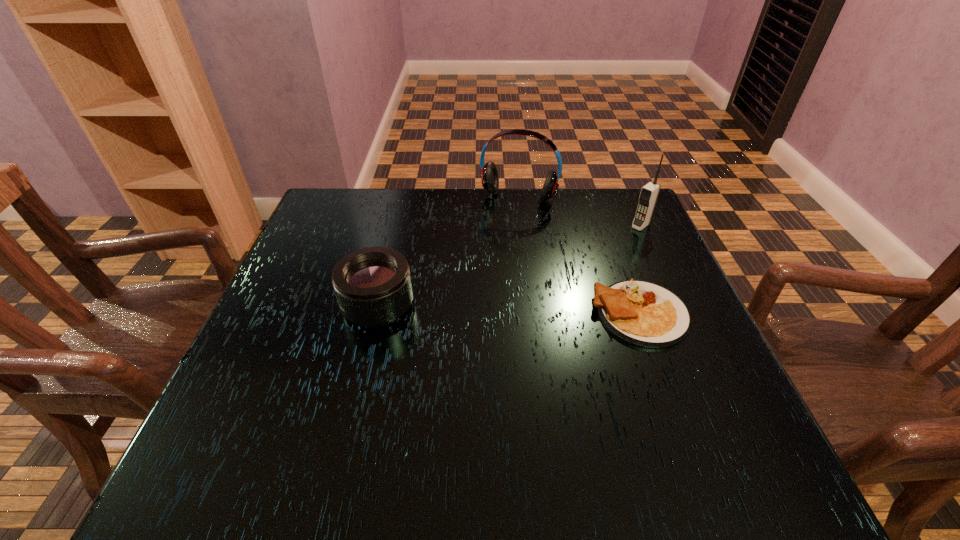
Where is `the third tallest object`? Image resolution: width=960 pixels, height=540 pixels. the third tallest object is located at coordinates (373, 287).

Where is `the leftmost object`? the leftmost object is located at coordinates (373, 287).

This screenshot has width=960, height=540. What are the coordinates of `omelet` in the screenshot? It's located at (642, 313).

This screenshot has width=960, height=540. I want to click on headset, so click(x=489, y=175).

You are a GUI agent. You are given a task and a screenshot of the screen. Output one action in this format:
    pyautogui.click(x=<x>, y=<y>)
    Task: Click on the cellular telephone
    This screenshot has width=960, height=540.
    Given the screenshot: What is the action you would take?
    pyautogui.click(x=649, y=193)

Identify the location of free space located on the side of the telephoto lens with brand markings and control switches. The width and height of the screenshot is (960, 540). (269, 305).

Locate an element on the screen. free spot located on the side of the telephoto lens with brand markings and control switches is located at coordinates (312, 305).

This screenshot has width=960, height=540. Find the location of `blank space located on the side of the telephoto lens with brand markings and control switches`. blank space located on the side of the telephoto lens with brand markings and control switches is located at coordinates (298, 305).

At what (x,y) coordinates should I click in order to perform the action: click on blank space located on the front of the shortest object. Please return your answer as a coordinate pair (x, y). The height and width of the screenshot is (540, 960). Looking at the image, I should click on (660, 370).

I want to click on free spot located 0.310m with the microphone attached to the side of the second object from left to right, so click(479, 308).